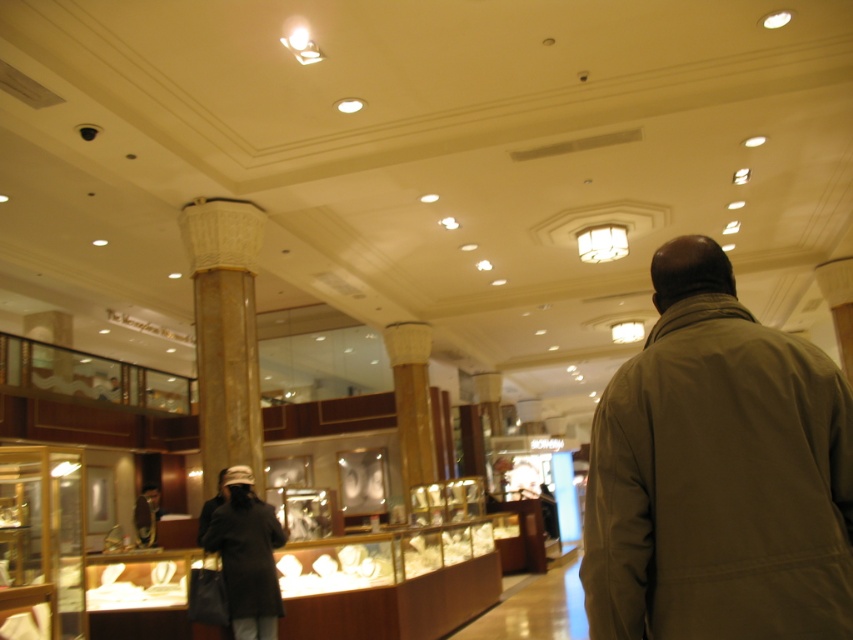
You are a customer in the jewelry store and want to try on both the khaki fabric jacket at center and the matte black jacket at lower left. Which jacket should you pick up first to access the other?

You should pick up the khaki fabric jacket at center first because it is positioned over the matte black jacket at lower left, so removing it will allow access to the matte black jacket at lower left underneath.

You are a customer in the jewelry store and want to try on the dark brown leather jacket at lower left. However, you notice that the jacket is placed at point (247,556). Can you estimate if this jacket is within your reach?

The dark brown leather jacket at lower left is located at point (247,556), which is within typical human reach in a jewelry store setting, so you can likely reach it.

You are a security guard in the jewelry store. You need to monitor the customer wearing the khaki fabric jacket at center. Where should you position yourself to have a clear view of their hands?

To monitor the customer wearing the khaki fabric jacket at center effectively, position yourself at a point that allows you to observe their hands while maintaining a safe distance. Since the customer is at coordinates approximately 0.741 on the x and 0.843 on the y axis, positioning yourself slightly behind and to the side of their position would provide an optimal vantage point for surveillance without being intrusive.